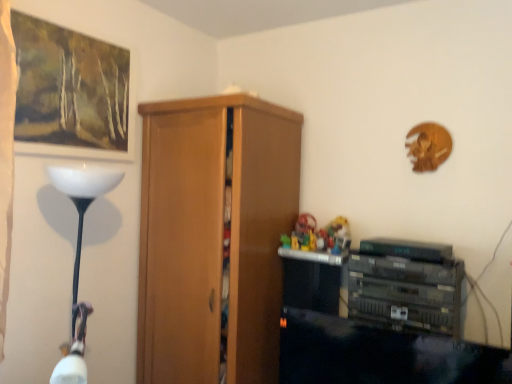
Question: Is matte wooden picture frame at upper left at the back of multicolored plastic toys at center?

Choices:
 (A) no
 (B) yes

Answer: (A)

Question: Is the depth of multicolored plastic toys at center less than that of matte wooden picture frame at upper left?

Choices:
 (A) yes
 (B) no

Answer: (B)

Question: Does multicolored plastic toys at center appear on the right side of matte wooden picture frame at upper left?

Choices:
 (A) yes
 (B) no

Answer: (A)

Question: Is multicolored plastic toys at center not near matte wooden picture frame at upper left?

Choices:
 (A) yes
 (B) no

Answer: (A)

Question: Considering the relative sizes of multicolored plastic toys at center and matte wooden picture frame at upper left in the image provided, is multicolored plastic toys at center taller than matte wooden picture frame at upper left?

Choices:
 (A) yes
 (B) no

Answer: (B)

Question: Is wooden cupboard at center spatially inside matte wooden picture frame at upper left, or outside of it?

Choices:
 (A) outside
 (B) inside

Answer: (A)

Question: Relative to matte wooden picture frame at upper left, is wooden cupboard at center in front or behind?

Choices:
 (A) front
 (B) behind

Answer: (B)

Question: From a real-world perspective, is wooden cupboard at center positioned above or below matte wooden picture frame at upper left?

Choices:
 (A) above
 (B) below

Answer: (B)

Question: Is wooden cupboard at center to the left or to the right of matte wooden picture frame at upper left in the image?

Choices:
 (A) left
 (B) right

Answer: (B)

Question: In terms of width, does multicolored plastic toys at center look wider or thinner when compared to matte wooden picture frame at upper left?

Choices:
 (A) thin
 (B) wide

Answer: (B)

Question: Considering the positions of multicolored plastic toys at center and matte wooden picture frame at upper left in the image, is multicolored plastic toys at center taller or shorter than matte wooden picture frame at upper left?

Choices:
 (A) short
 (B) tall

Answer: (A)

Question: From a real-world perspective, is multicolored plastic toys at center positioned above or below matte wooden picture frame at upper left?

Choices:
 (A) above
 (B) below

Answer: (B)

Question: Considering their positions, is multicolored plastic toys at center located in front of or behind matte wooden picture frame at upper left?

Choices:
 (A) front
 (B) behind

Answer: (B)

Question: Is wooden cupboard at center in front of or behind multicolored plastic toys at center in the image?

Choices:
 (A) behind
 (B) front

Answer: (B)

Question: In terms of height, does wooden cupboard at center look taller or shorter compared to multicolored plastic toys at center?

Choices:
 (A) short
 (B) tall

Answer: (B)